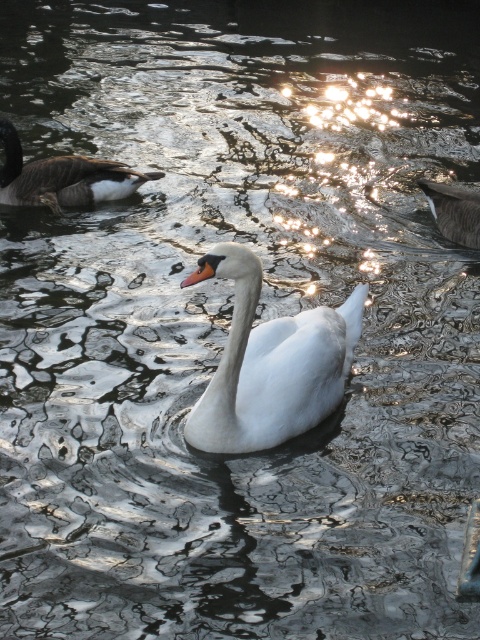
Does white glossy swan at center have a lesser height compared to brown fuzzy duck at upper right?

In fact, white glossy swan at center may be taller than brown fuzzy duck at upper right.

Does white glossy swan at center have a greater width compared to brown fuzzy duck at upper right?

Yes.

You are a GUI agent. You are given a task and a screenshot of the screen. Output one action in this format:
    pyautogui.click(x=<x>, y=<y>)
    Task: Click on the white glossy swan at center
    
    Given the screenshot: What is the action you would take?
    pyautogui.click(x=269, y=364)

Describe the element at coordinates (269, 364) in the screenshot. I see `white glossy swan at center` at that location.

This screenshot has width=480, height=640. Identify the location of white glossy swan at center. (269, 364).

Can you confirm if brown fuzzy duck at upper left is positioned above brown fuzzy duck at upper right?

Yes.

In the scene shown: Between brown fuzzy duck at upper left and brown fuzzy duck at upper right, which one has less height?

With less height is brown fuzzy duck at upper right.

Which is in front, point (88, 182) or point (427, 186)?

Point (88, 182) is in front.

Image resolution: width=480 pixels, height=640 pixels. Identify the location of brown fuzzy duck at upper left. (62, 177).